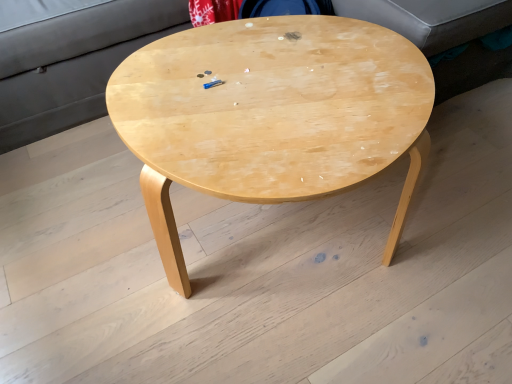
Image resolution: width=512 pixels, height=384 pixels. Find the location of `free space above natural wood coffee table at center (from a real-world perspective)`. free space above natural wood coffee table at center (from a real-world perspective) is located at coordinates (279, 83).